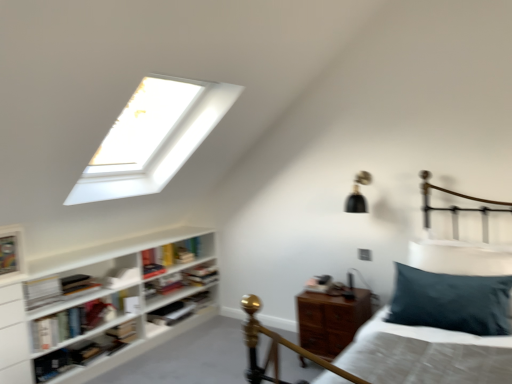
Question: Can you confirm if white matte bookshelf at lower left, which is the 3th book in front-to-back order, is smaller than teal velvet pillow at right?

Choices:
 (A) no
 (B) yes

Answer: (B)

Question: Does white matte bookshelf at lower left, the sixth book viewed from the back, turn towards teal velvet pillow at right?

Choices:
 (A) yes
 (B) no

Answer: (A)

Question: Does white matte bookshelf at lower left, the sixth book viewed from the back, have a larger size compared to teal velvet pillow at right?

Choices:
 (A) yes
 (B) no

Answer: (B)

Question: Can you confirm if white matte bookshelf at lower left, the sixth book viewed from the back, is positioned to the right of teal velvet pillow at right?

Choices:
 (A) yes
 (B) no

Answer: (B)

Question: From the image's perspective, is white matte bookshelf at lower left, which is the 3th book in front-to-back order, beneath teal velvet pillow at right?

Choices:
 (A) no
 (B) yes

Answer: (B)

Question: Can you confirm if white matte bookshelf at lower left, which is the 3th book in front-to-back order, is shorter than teal velvet pillow at right?

Choices:
 (A) no
 (B) yes

Answer: (B)

Question: Considering the relative sizes of hardcover book at center, which is counted as the 6th book, starting from the front, and white matte bookshelf at lower left, the sixth book viewed from the back, in the image provided, is hardcover book at center, which is counted as the 6th book, starting from the front, shorter than white matte bookshelf at lower left, the sixth book viewed from the back,?

Choices:
 (A) yes
 (B) no

Answer: (B)

Question: Is hardcover book at center, which is counted as the 6th book, starting from the front, behind white matte bookshelf at lower left, which is the 3th book in front-to-back order?

Choices:
 (A) yes
 (B) no

Answer: (A)

Question: From the image's perspective, is hardcover book at center, the third book from the back, on white matte bookshelf at lower left, which is the 3th book in front-to-back order?

Choices:
 (A) yes
 (B) no

Answer: (B)

Question: Does hardcover book at center, the third book from the back, have a greater width compared to white matte bookshelf at lower left, the sixth book viewed from the back?

Choices:
 (A) no
 (B) yes

Answer: (B)

Question: From a real-world perspective, is hardcover book at center, which is counted as the 6th book, starting from the front, physically below white matte bookshelf at lower left, which is the 3th book in front-to-back order?

Choices:
 (A) no
 (B) yes

Answer: (B)

Question: Is there a large distance between hardcover book at center, the third book from the back, and white matte bookshelf at lower left, the sixth book viewed from the back?

Choices:
 (A) yes
 (B) no

Answer: (B)

Question: Is wooden nightstand at lower right positioned behind white matte bookshelf at lower left, the sixth book viewed from the back?

Choices:
 (A) yes
 (B) no

Answer: (B)